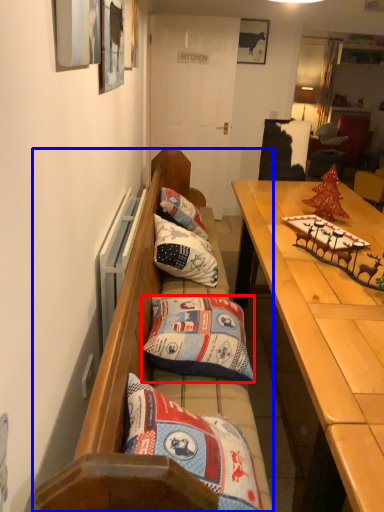
Question: Which object is closer to the camera taking this photo, pillow (highlighted by a red box) or studio couch (highlighted by a blue box)?

Choices:
 (A) pillow
 (B) studio couch

Answer: (B)